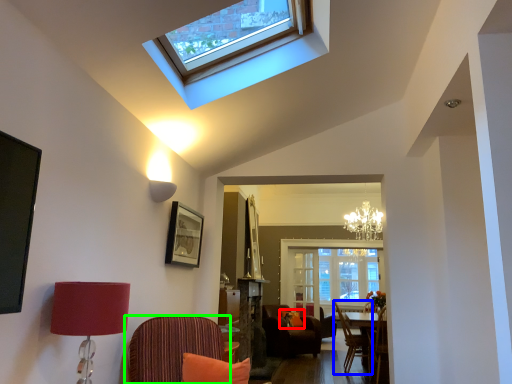
Question: Considering the real-world distances, which object is closest to pillow (highlighted by a red box)? chair (highlighted by a blue box) or chair (highlighted by a green box).

Choices:
 (A) chair
 (B) chair

Answer: (A)